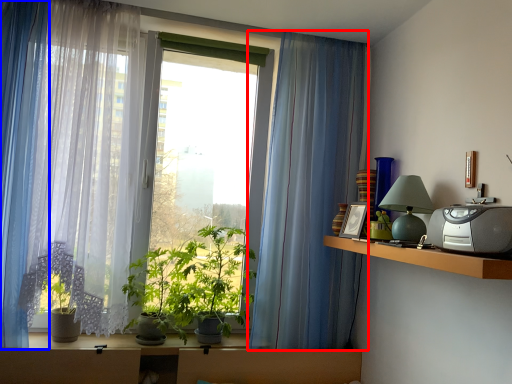
Question: Among these objects, which one is farthest to the camera, curtain (highlighted by a red box) or curtain (highlighted by a blue box)?

Choices:
 (A) curtain
 (B) curtain

Answer: (A)